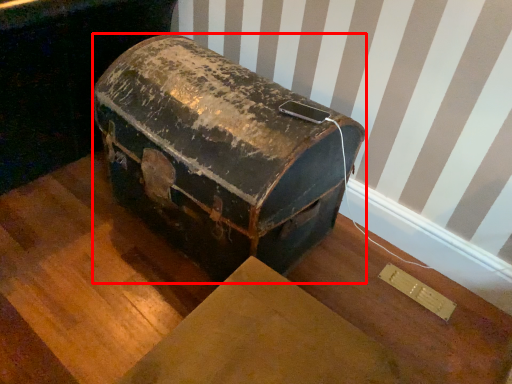
Question: From the image's perspective, where is suitcase (annotated by the red box) located in relation to furniture in the image?

Choices:
 (A) above
 (B) below

Answer: (B)